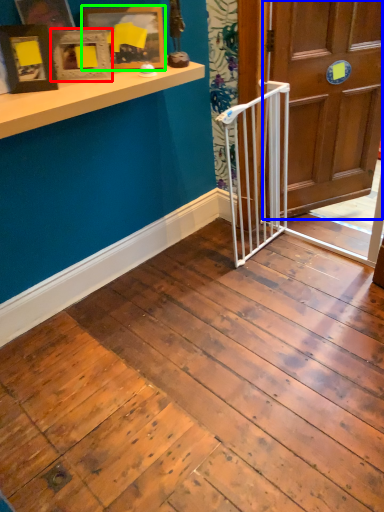
Question: Which object is the farthest from picture frame (highlighted by a red box)? Choose among these: door (highlighted by a blue box) or picture frame (highlighted by a green box).

Choices:
 (A) door
 (B) picture frame

Answer: (A)